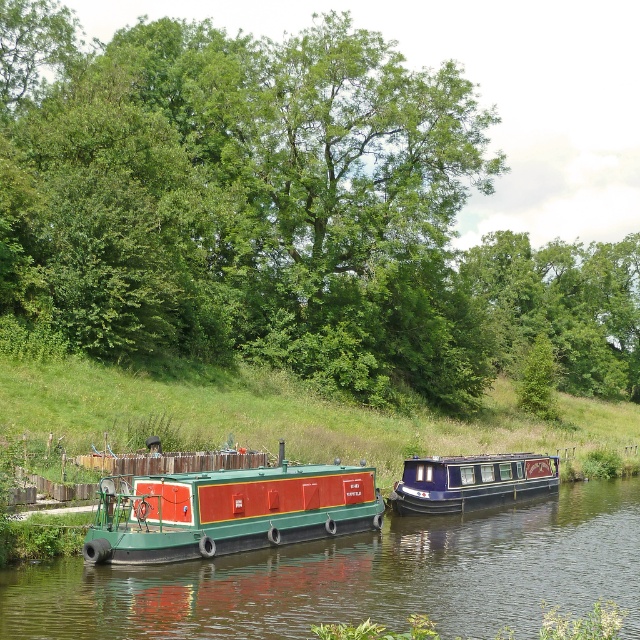
You are standing on the riverbank and see the green leafy tree at center and the green matte barge at center. Which object is positioned to the right when facing the river?

The green leafy tree at center is to the right of the green matte barge at center, so when facing the river, the green leafy tree at center is positioned to the right.

You are a photographer wanting to capture both the green leafy tree at center and the green matte barge at center in a single frame. Which object should you focus on first to ensure both are in the frame without moving the camera?

You should focus on the green leafy tree at center first because it is larger in size than the green matte barge at center, so it will take up more space in the frame.